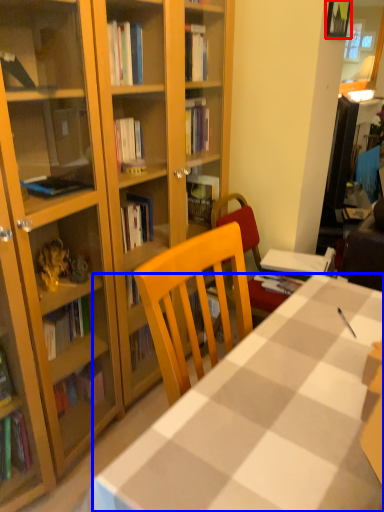
Question: Which object is closer to the camera taking this photo, picture frame (highlighted by a red box) or desk (highlighted by a blue box)?

Choices:
 (A) picture frame
 (B) desk

Answer: (B)